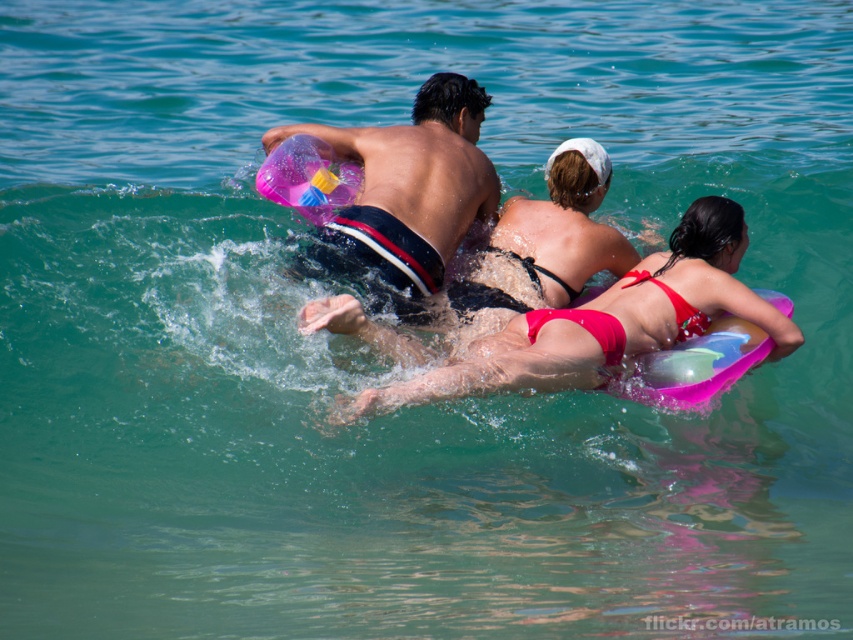
Question: From the image, what is the correct spatial relationship of matte pink bikini at center in relation to matte black bikini at center?

Choices:
 (A) above
 (B) below

Answer: (B)

Question: From the image, what is the correct spatial relationship of matte pink bikini at center in relation to pink rubber ball at center?

Choices:
 (A) below
 (B) above

Answer: (A)

Question: Which point is farther to the camera?

Choices:
 (A) (682, 328)
 (B) (596, 164)

Answer: (B)

Question: Which point is closer to the camera taking this photo?

Choices:
 (A) (456, 156)
 (B) (537, 253)
 (C) (773, 332)

Answer: (C)

Question: Which of the following is the closest to the observer?

Choices:
 (A) matte pink bikini at center
 (B) pink rubber ball at center

Answer: (A)

Question: Does matte pink bikini at center appear over pink rubber ball at center?

Choices:
 (A) no
 (B) yes

Answer: (A)